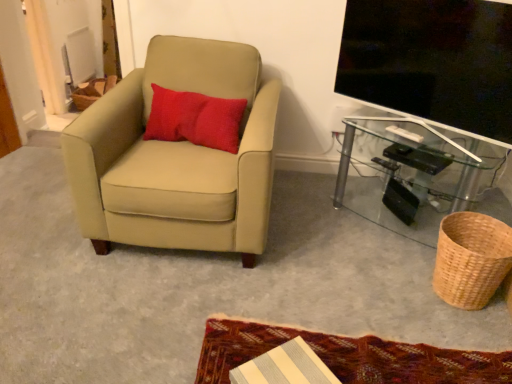
The width and height of the screenshot is (512, 384). Identify the location of vacant space that is to the left of textured woolen mat at lower center. (158, 308).